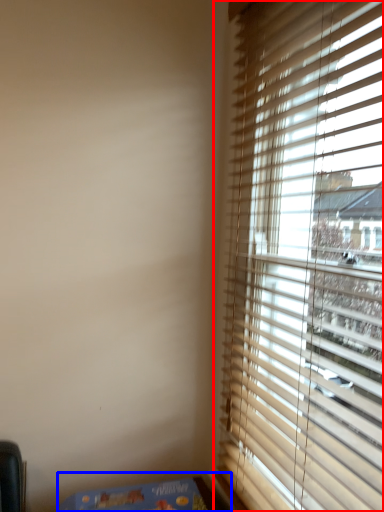
Question: Which object is closer to the camera taking this photo, window (highlighted by a red box) or table (highlighted by a blue box)?

Choices:
 (A) window
 (B) table

Answer: (A)